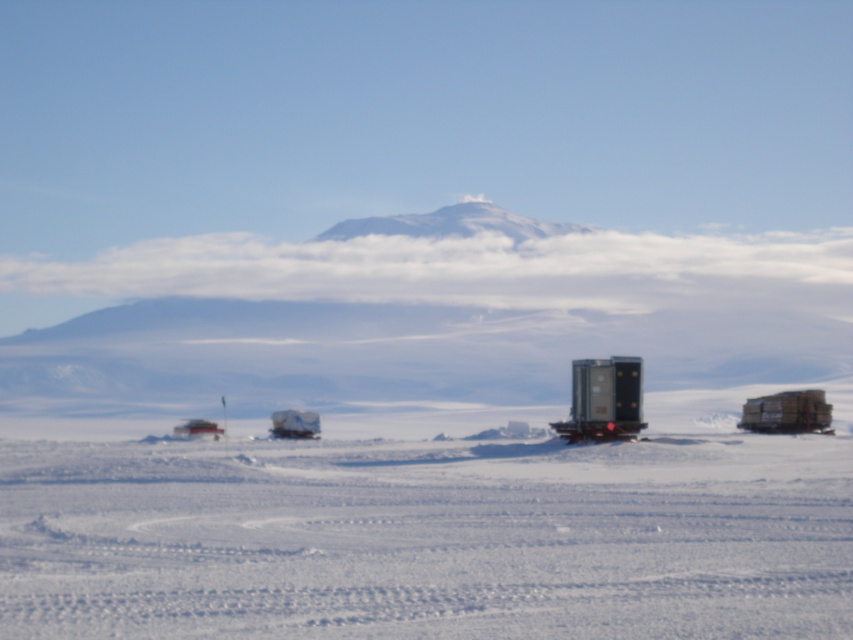
You are a delivery driver who needs to park your trailer truck in the snow. Based on the scene, can you determine if the white matte snow at center has enough space to accommodate the metallic trailer truck at center?

The white matte snow at center is larger in size than the metallic trailer truck at center, so yes, there is enough space to accommodate the metallic trailer truck at center.

You are a researcher planning to move equipment from the metallic trailer truck at center to the white plastic boat at center. Given that your equipment can only be transported if the distance between them is less than 20 feet, can you safely move the equipment without needing additional transport?

The distance between the metallic trailer truck at center and the white plastic boat at center is 19.58 feet, which is less than 20 feet. Therefore, you can safely move the equipment without needing additional transport.

You are standing at the point marked as point (427, 538) in the snowy landscape. What is the terrain like at this location?

The terrain at point (427, 538) is white matte snow at center.